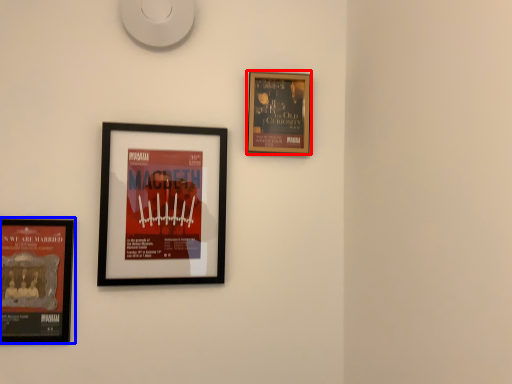
Question: Which point is closer to the camera, picture frame (highlighted by a red box) or picture frame (highlighted by a blue box)?

Choices:
 (A) picture frame
 (B) picture frame

Answer: (B)